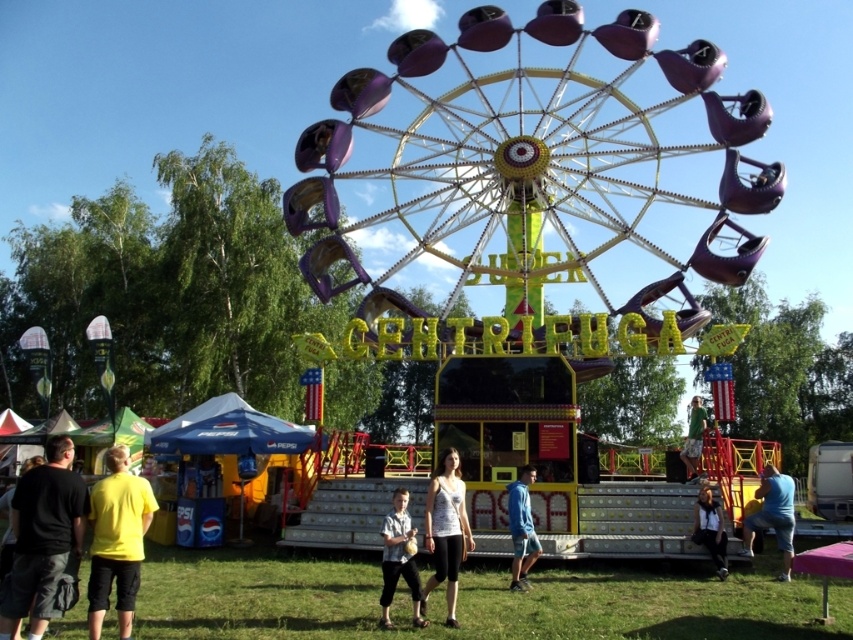
Does metallic purple ferris wheel at center have a lesser width compared to black cotton shirt at lower left?

No.

Image resolution: width=853 pixels, height=640 pixels. I want to click on metallic purple ferris wheel at center, so click(x=534, y=172).

Where is `metallic purple ferris wheel at center`? Image resolution: width=853 pixels, height=640 pixels. metallic purple ferris wheel at center is located at coordinates (534, 172).

Is white matte tank top at center bigger than light blue shirt at center?

Incorrect, white matte tank top at center is not larger than light blue shirt at center.

Is white matte tank top at center above light blue shirt at center?

Indeed, white matte tank top at center is positioned over light blue shirt at center.

Between point (453, 586) and point (402, 528), which one is positioned behind?

Positioned behind is point (402, 528).

At what (x,y) coordinates should I click in order to perform the action: click on white matte tank top at center. Please return your answer as a coordinate pair (x, y). Looking at the image, I should click on (445, 529).

Measure the distance between black cotton shirt at lower left and white cotton shirt at lower right.

They are 88.91 meters apart.

Image resolution: width=853 pixels, height=640 pixels. What do you see at coordinates (44, 536) in the screenshot? I see `black cotton shirt at lower left` at bounding box center [44, 536].

What do you see at coordinates (44, 536) in the screenshot? This screenshot has width=853, height=640. I see `black cotton shirt at lower left` at bounding box center [44, 536].

I want to click on black cotton shirt at lower left, so click(x=44, y=536).